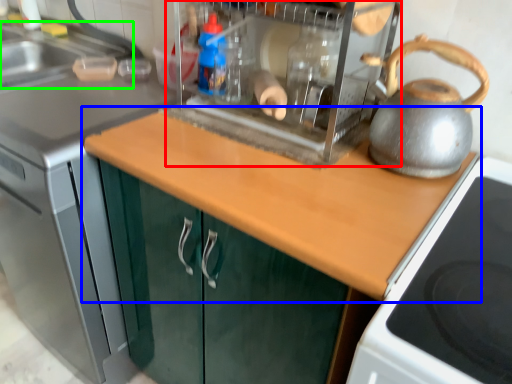
Question: Which object is the closest to the appliance (highlighted by a red box)? Choose among these: countertop (highlighted by a blue box) or sink (highlighted by a green box).

Choices:
 (A) countertop
 (B) sink

Answer: (A)